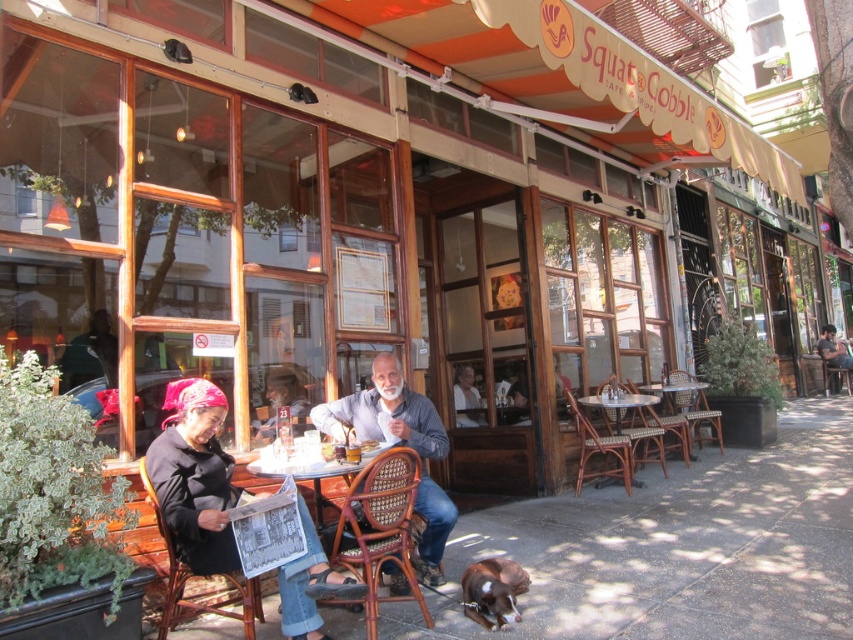
Question: In this image, where is black fabric jacket at center located relative to blue denim shirt at center?

Choices:
 (A) left
 (B) right

Answer: (A)

Question: Is the position of blue denim shirt at center more distant than that of metallic wicker table at center?

Choices:
 (A) yes
 (B) no

Answer: (A)

Question: Where is blue denim shirt at center located in relation to rustic wooden table at center in the image?

Choices:
 (A) right
 (B) left

Answer: (B)

Question: Which object is farther from the camera taking this photo?

Choices:
 (A) metallic wicker table at center
 (B) brown wicker table at center

Answer: (B)

Question: Which point is closer to the camera taking this photo?

Choices:
 (A) (467, 568)
 (B) (606, 397)

Answer: (A)

Question: Which object is closer to the camera taking this photo?

Choices:
 (A) black fabric jacket at center
 (B) rustic wooden table at center
 (C) brown wicker table at center
 (D) metallic wicker table at center

Answer: (A)